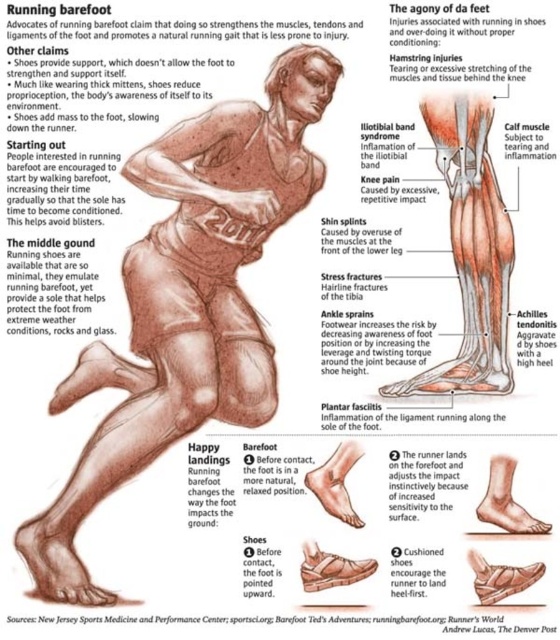
You are analyzing the diagram comparing barefoot running and shod running. You notice two feet in the illustration. The brown textured foot at lower left and the matte skin foot at lower center. Which foot is positioned more to the left side of the image?

The brown textured foot at lower left is positioned more to the left side of the image compared to the matte skin foot at lower center.

You are analyzing the diagram comparing barefoot running and shod running. In the image, there is a brown textured foot at lower left. Where exactly is this foot positioned in relation to the rest of the runner?

The brown textured foot at lower left is located at point coordinates (58, 564), which places it at the lower left portion of the image, indicating its position relative to the runner.

Based on the diagram, where is the matte brown arm at upper center located in terms of coordinates?

The matte brown arm at upper center is located at coordinates point (203, 161).